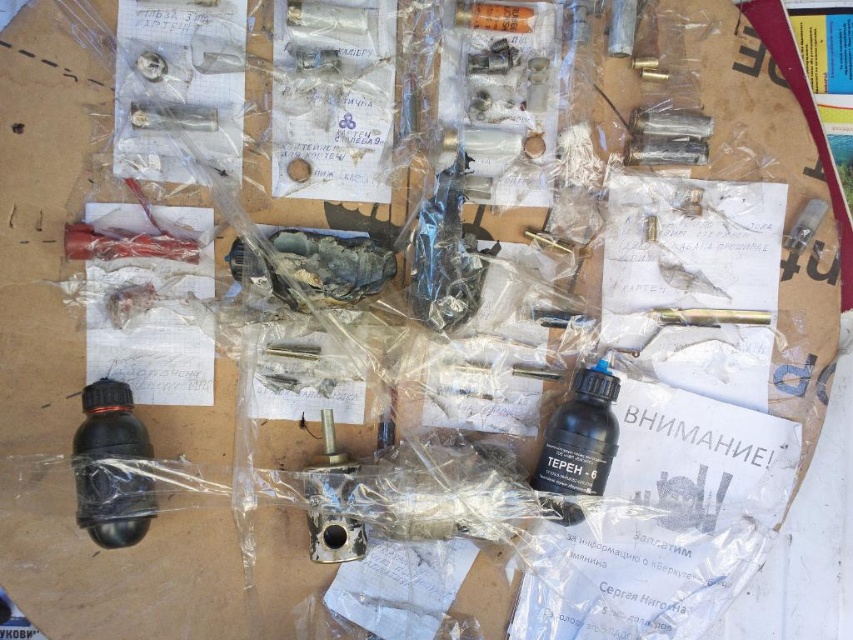
Can you confirm if black matte bottle at lower left is positioned to the right of black matte bottle at center?

Incorrect, black matte bottle at lower left is not on the right side of black matte bottle at center.

Does black matte bottle at lower left lie in front of black matte bottle at center?

Yes.

What do you see at coordinates (111, 467) in the screenshot? I see `black matte bottle at lower left` at bounding box center [111, 467].

Where is `black matte bottle at lower left`? Image resolution: width=853 pixels, height=640 pixels. black matte bottle at lower left is located at coordinates (111, 467).